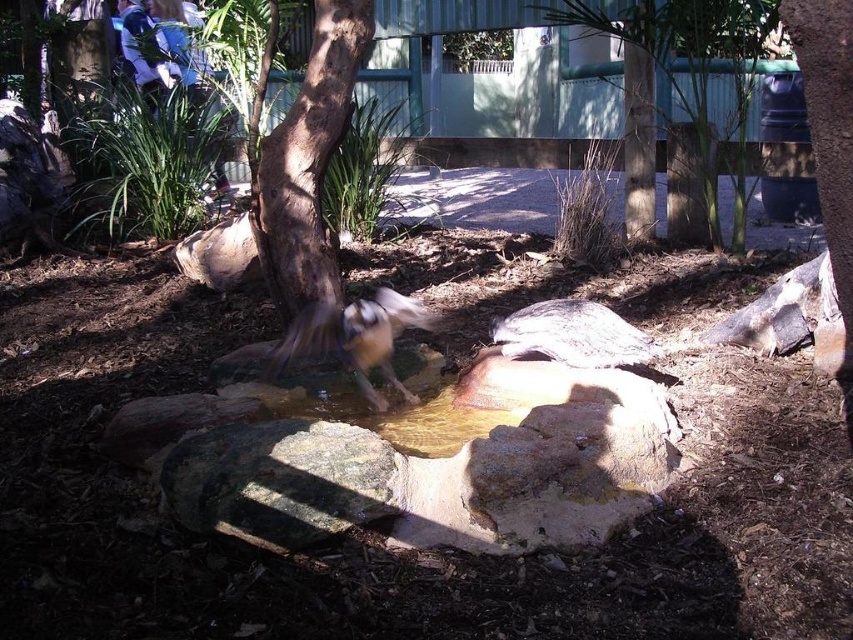
Does translucent wet rock at center have a greater height compared to white feathered bird at center?

No.

The image size is (853, 640). Find the location of `translucent wet rock at center`. translucent wet rock at center is located at coordinates (392, 403).

Between point (418, 424) and point (310, 349), which one is positioned in front?

Point (418, 424) is more forward.

At what (x,y) coordinates should I click in order to perform the action: click on translucent wet rock at center. Please return your answer as a coordinate pair (x, y). This screenshot has width=853, height=640. Looking at the image, I should click on (392, 403).

Which is more to the left, brown rough bark tree at center or gray textured turtle at center?

From the viewer's perspective, brown rough bark tree at center appears more on the left side.

Does point (297, 292) come in front of point (645, 364)?

No.

You are a GUI agent. You are given a task and a screenshot of the screen. Output one action in this format:
    pyautogui.click(x=<x>, y=<y>)
    Task: Click on the brown rough bark tree at center
    This screenshot has width=853, height=640.
    Given the screenshot: What is the action you would take?
    pyautogui.click(x=306, y=161)

Based on the photo, who is more distant from viewer, (751, 86) or (368, 342)?

Point (751, 86)

Who is more forward, (635,140) or (288,349)?

Point (288,349) is more forward.

The height and width of the screenshot is (640, 853). Find the location of `brown textured tree at upper center`. brown textured tree at upper center is located at coordinates (685, 67).